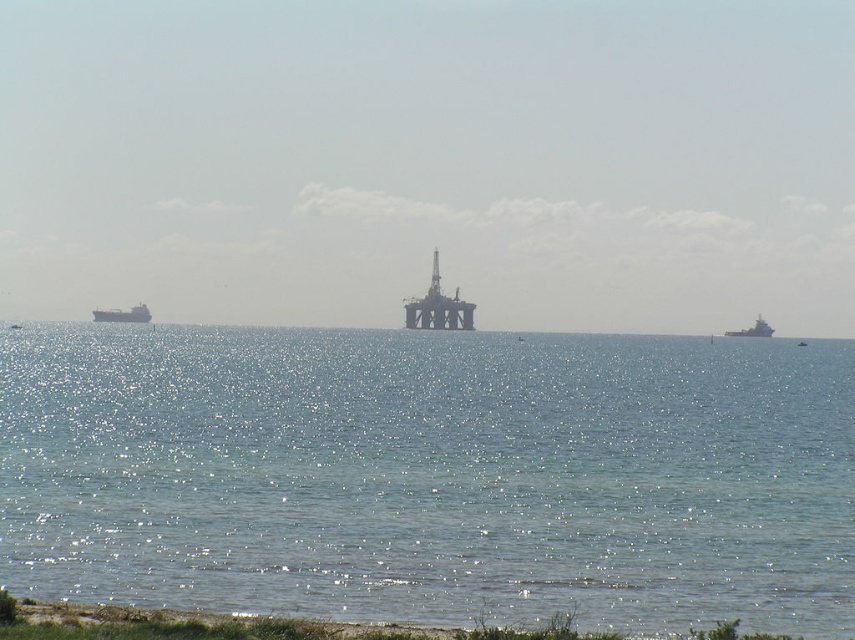
Who is positioned more to the left, clear blue water at center or matte gray cargo ship at left?

matte gray cargo ship at left

Does clear blue water at center have a larger size compared to matte gray cargo ship at left?

Correct, clear blue water at center is larger in size than matte gray cargo ship at left.

What do you see at coordinates (431, 474) in the screenshot? I see `clear blue water at center` at bounding box center [431, 474].

The width and height of the screenshot is (855, 640). Find the location of `clear blue water at center`. clear blue water at center is located at coordinates (431, 474).

Can you confirm if matte gray cargo ship at left is positioned above metallic gray ship at right?

Yes.

Does matte gray cargo ship at left have a greater width compared to metallic gray ship at right?

Correct, the width of matte gray cargo ship at left exceeds that of metallic gray ship at right.

Who is more forward, (125, 317) or (744, 336)?

Point (125, 317) is more forward.

This screenshot has width=855, height=640. In order to click on matte gray cargo ship at left in this screenshot , I will do `click(122, 314)`.

Is clear blue water at center shorter than metallic gray ship at right?

No, clear blue water at center is not shorter than metallic gray ship at right.

Is clear blue water at center wider than metallic gray ship at right?

Correct, the width of clear blue water at center exceeds that of metallic gray ship at right.

The width and height of the screenshot is (855, 640). What do you see at coordinates (431, 474) in the screenshot?
I see `clear blue water at center` at bounding box center [431, 474].

Locate an element on the screen. The width and height of the screenshot is (855, 640). clear blue water at center is located at coordinates (431, 474).